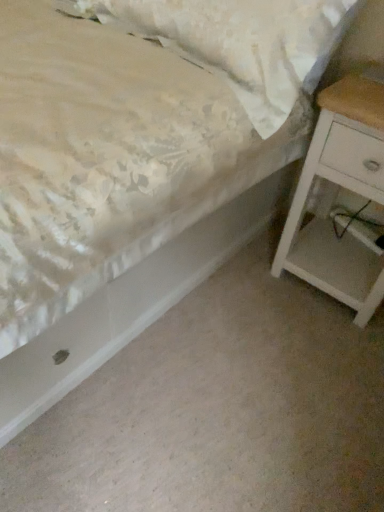
Identify the location of blank area to the left of white matte nightstand at right. (252, 284).